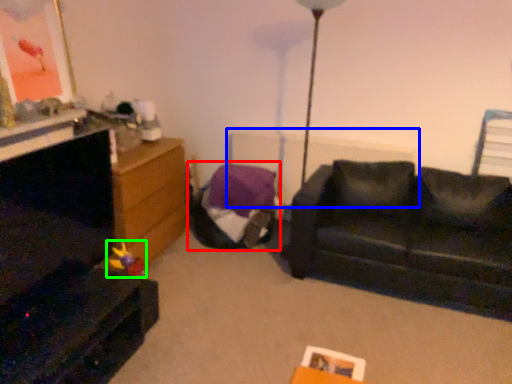
Question: Considering the real-world distances, which object is farthest from bean bag chair (highlighted by a red box)? radiator (highlighted by a blue box) or toy (highlighted by a green box)?

Choices:
 (A) radiator
 (B) toy

Answer: (B)